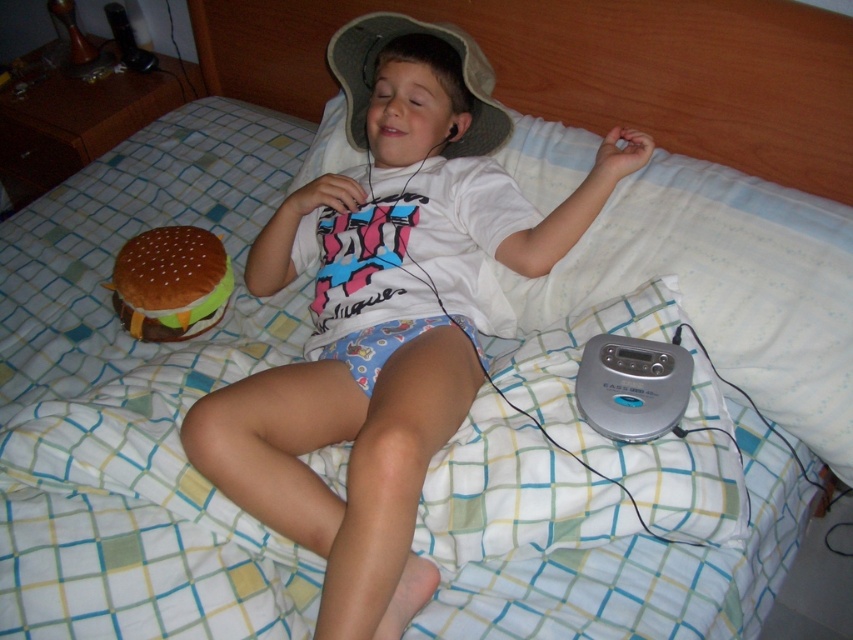
Who is positioned more to the left, white cotton shirt at center or gray fabric baseball hat at center?

gray fabric baseball hat at center is more to the left.

Locate an element on the screen. white cotton shirt at center is located at coordinates (386, 314).

Can you confirm if brown plush/hairy hamburger at left is positioned to the left of gray fabric baseball hat at center?

Correct, you'll find brown plush/hairy hamburger at left to the left of gray fabric baseball hat at center.

Is point (125, 314) positioned behind point (328, 45)?

No, it is not.

At what (x,y) coordinates should I click in order to perform the action: click on brown plush/hairy hamburger at left. Please return your answer as a coordinate pair (x, y). The height and width of the screenshot is (640, 853). Looking at the image, I should click on (170, 282).

Does white cotton shirt at center come behind brown plush/hairy hamburger at left?

No, white cotton shirt at center is closer to the viewer.

How distant is white cotton shirt at center from brown plush/hairy hamburger at left?

A distance of 11.67 inches exists between white cotton shirt at center and brown plush/hairy hamburger at left.

Does point (364, 548) come in front of point (112, 291)?

That is True.

At what (x,y) coordinates should I click in order to perform the action: click on white cotton shirt at center. Please return your answer as a coordinate pair (x, y). Looking at the image, I should click on (386, 314).